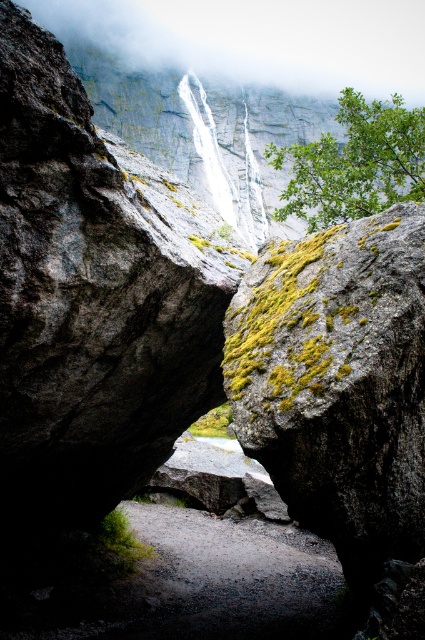
You are an adventurer hiking towards the waterfall and notice the white misty fog at upper center and the gray gravel path at center. Which object is higher in elevation compared to the other?

The white misty fog at upper center is much taller than the gray gravel path at center, so it is higher in elevation.

You are a hiker planning to cross the gray gravel path at center. The white smooth waterfall at center is above you. Is the path safe to walk on?

The gray gravel path at center is below the white smooth waterfall at center, so the path might be slippery due to water from the waterfall. It is recommended to proceed with caution.

You are an adventurer standing at the entrance of the rocky landscape. You see the white misty fog at upper center and the gray gravel path at center. Which object appears bigger in the scene?

The white misty fog at upper center appears bigger than the gray gravel path at center because it has a larger size according to the description.